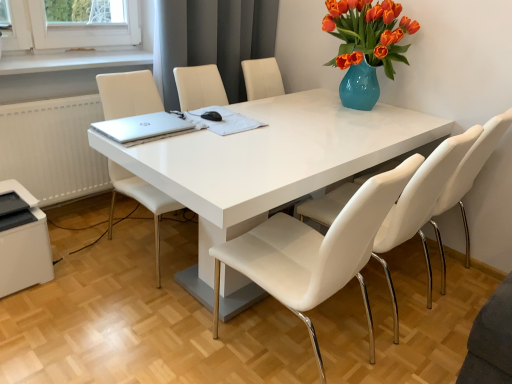
Image resolution: width=512 pixels, height=384 pixels. Find the location of `free space behind white plastic printer at lower left`. free space behind white plastic printer at lower left is located at coordinates (71, 236).